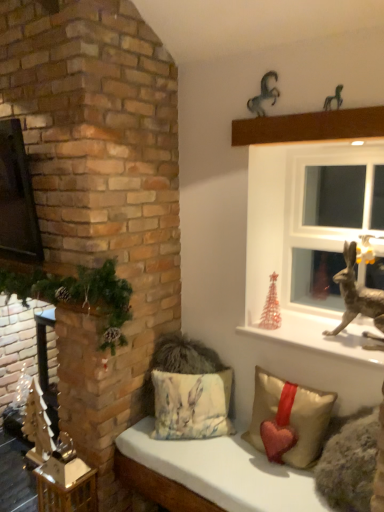
Identify the location of vacant space positioned to the left of translucent glass christmas tree at right, which ranks as the first christmas decoration in right-to-left order. This screenshot has width=384, height=512. (248, 327).